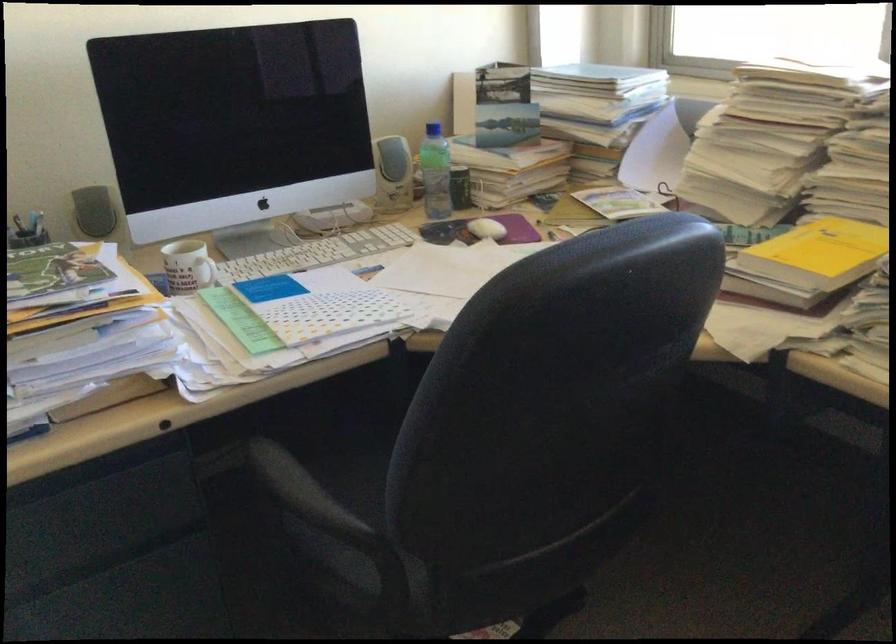
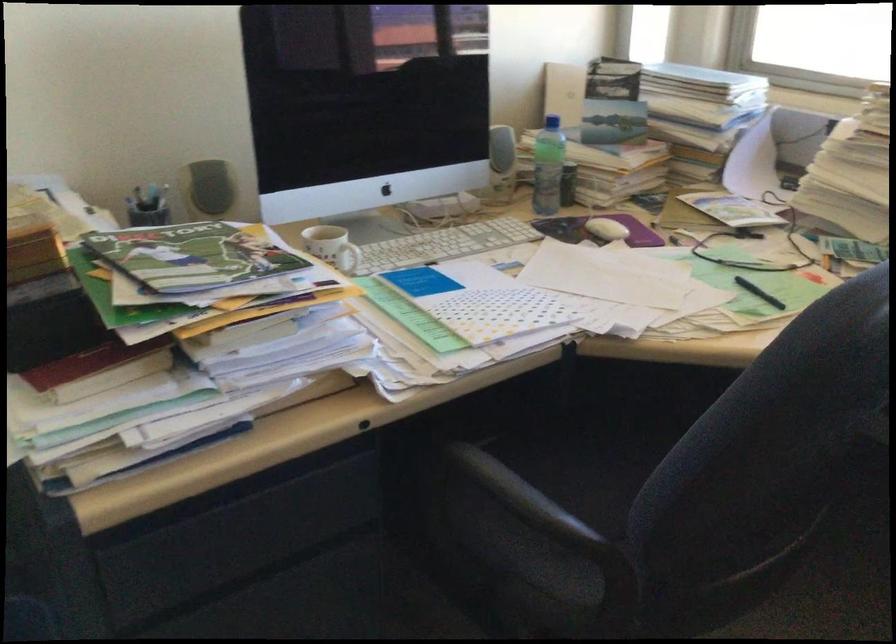
Where in the second image is the point corresponding to (x=306, y=496) from the first image?

(532, 506)